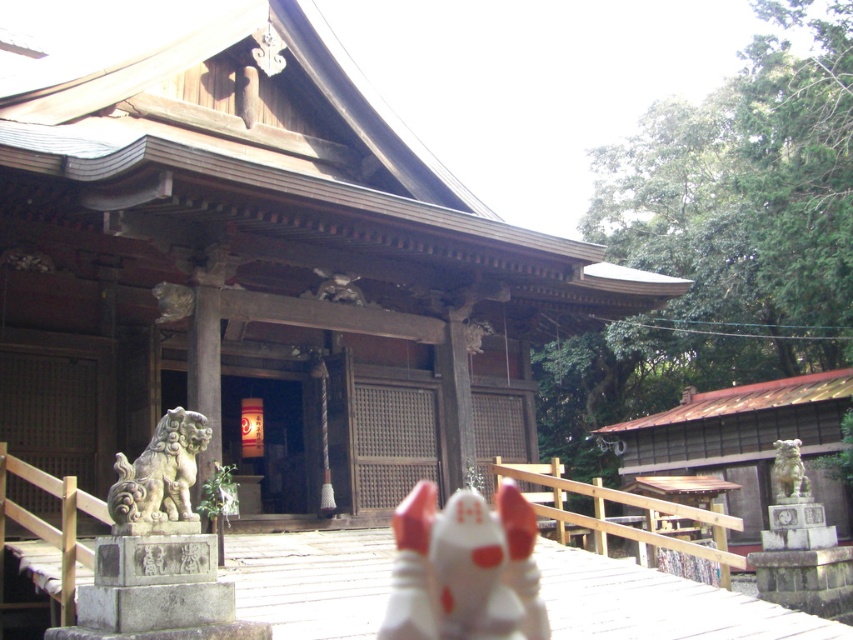
Question: Is smooth stone statue at center to the left of matte stone lion at right from the viewer's perspective?

Choices:
 (A) yes
 (B) no

Answer: (A)

Question: Considering the real-world distances, which object is farthest from the white matte fox at center?

Choices:
 (A) matte stone lion at right
 (B) smooth stone statue at center

Answer: (A)

Question: Does white matte fox at center come behind gray stone lion at left?

Choices:
 (A) yes
 (B) no

Answer: (A)

Question: Which point is farther to the camera?

Choices:
 (A) (793, 474)
 (B) (167, 404)
 (C) (193, 416)

Answer: (B)

Question: Estimate the real-world distances between objects in this image. Which object is closer to the matte stone lion at right?

Choices:
 (A) gray stone lion at left
 (B) white matte fox at center

Answer: (B)

Question: In this image, where is smooth stone statue at center located relative to matte stone lion at right?

Choices:
 (A) above
 (B) below

Answer: (A)